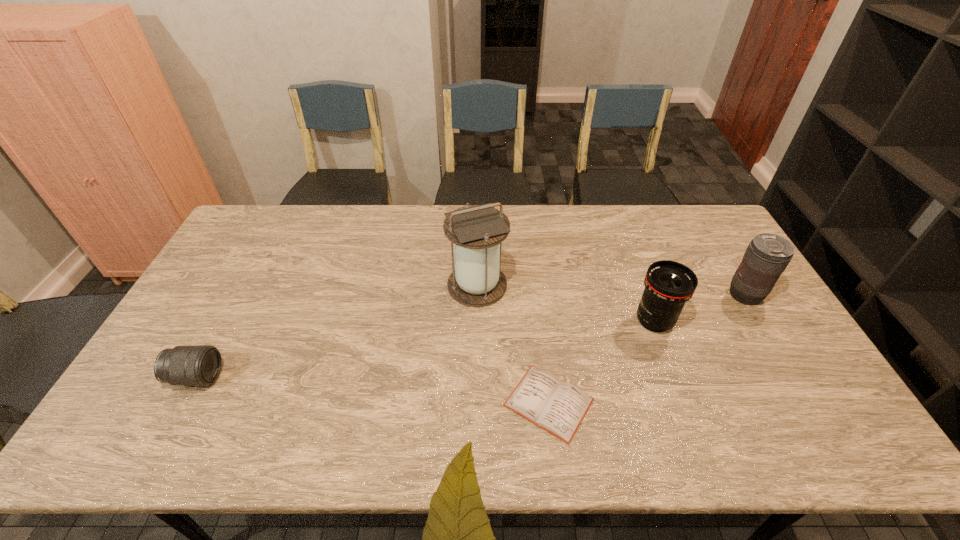
This screenshot has height=540, width=960. I want to click on the tallest object, so click(477, 231).

Where is `the rightmost object`? The width and height of the screenshot is (960, 540). the rightmost object is located at coordinates (767, 256).

What are the coordinates of `the second telephoto lens from left to right` in the screenshot? It's located at (669, 285).

This screenshot has width=960, height=540. I want to click on the nearest telephoto lens, so click(x=200, y=365).

At what (x,y) coordinates should I click in order to perform the action: click on the shortest telephoto lens. Please return your answer as a coordinate pair (x, y). The width and height of the screenshot is (960, 540). Looking at the image, I should click on (200, 365).

At what (x,y) coordinates should I click in order to perform the action: click on diary. Please return your answer as a coordinate pair (x, y). The width and height of the screenshot is (960, 540). Looking at the image, I should click on (558, 407).

This screenshot has width=960, height=540. I want to click on vacant region located 0.320m on the right of the tallest object, so click(608, 286).

I want to click on free location located 0.200m on the side of the rightmost object where the control switches are located, so click(662, 295).

You are a GUI agent. You are given a task and a screenshot of the screen. Output one action in this format:
    pyautogui.click(x=<x>, y=<y>)
    Task: Click on the vacant region located 0.380m on the side of the rightmost object where the control switches are located
    
    Given the screenshot: What is the action you would take?
    pyautogui.click(x=604, y=295)

You are a GUI agent. You are given a task and a screenshot of the screen. Output one action in this format:
    pyautogui.click(x=<x>, y=<y>)
    Task: Click on the free point located on the side of the rightmost object where the control switches are located
    This screenshot has height=540, width=960.
    Given the screenshot: What is the action you would take?
    pyautogui.click(x=617, y=295)